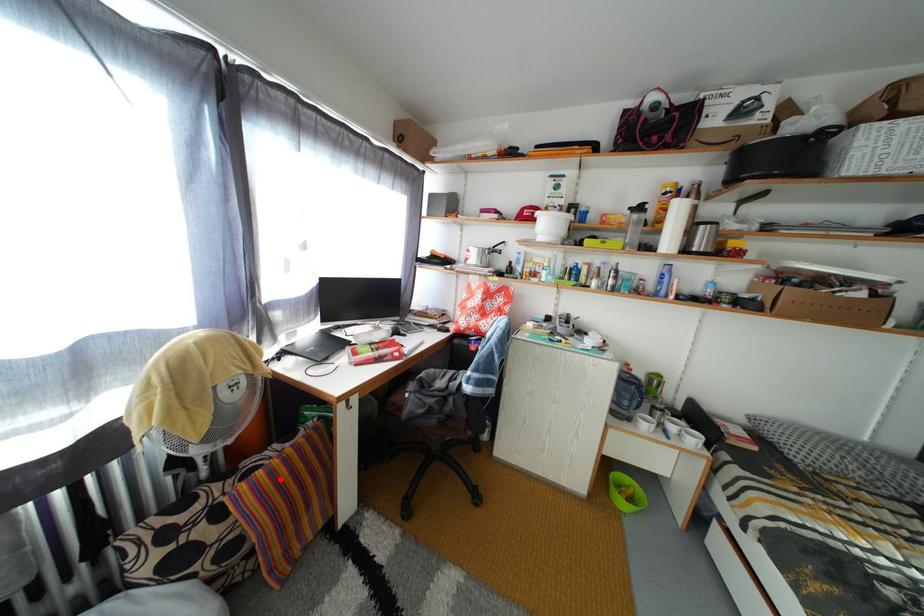
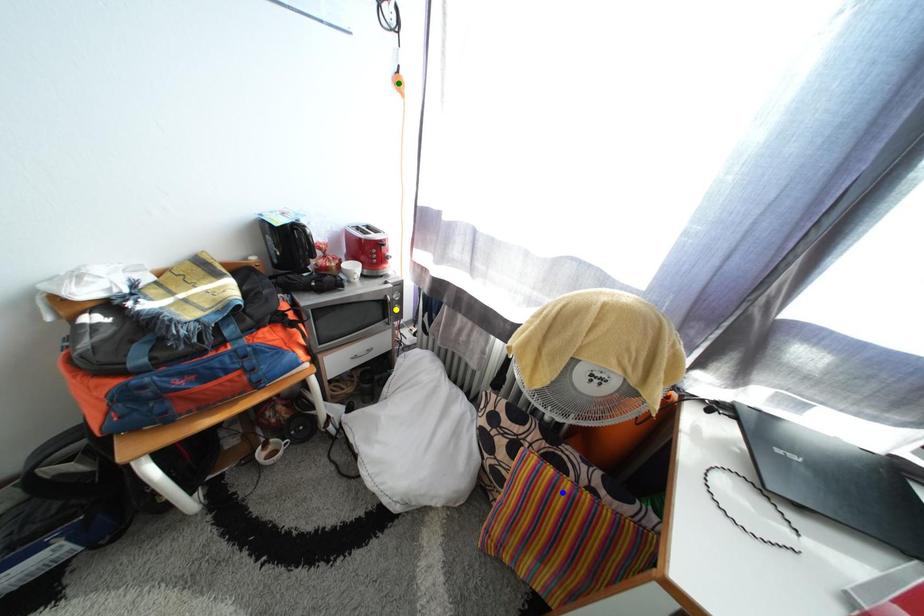
Question: I am providing you with two images of the same scene from different viewpoints. A red point is marked on the first image. You are given multiple points on the second image. Which point in image 2 is actually the same real-world point as the red point in image 1?

Choices:
 (A) green point
 (B) yellow point
 (C) blue point

Answer: (C)